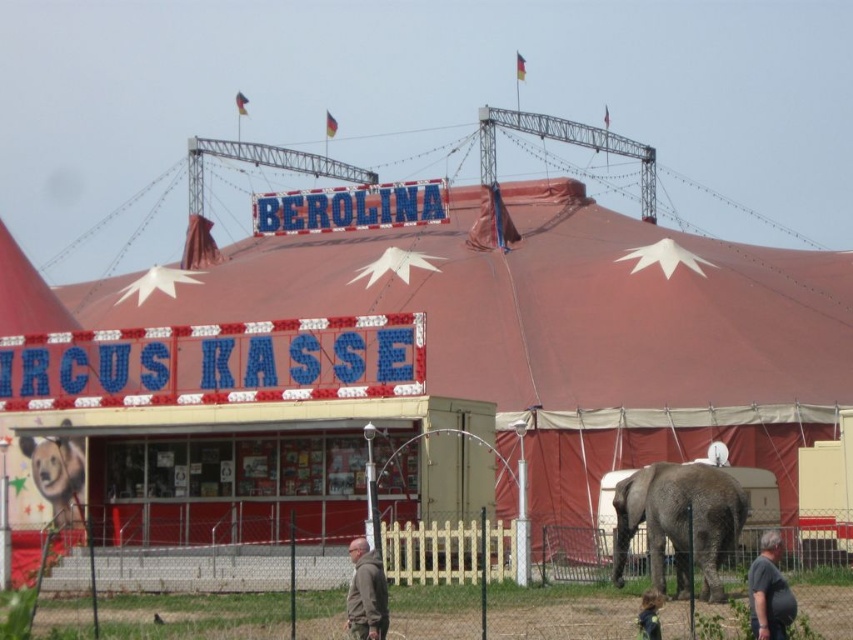
Who is positioned more to the right, fat man at lower right or gray hoodie at center?

Positioned to the right is fat man at lower right.

Which is above, fat man at lower right or gray hoodie at center?

fat man at lower right is above.

Is point (764, 570) closer to viewer compared to point (381, 621)?

That is True.

This screenshot has height=640, width=853. What are the coordinates of `fat man at lower right` in the screenshot? It's located at (769, 592).

Can you confirm if red canvas tent at center is thinner than gray matte elephant at lower right?

No, red canvas tent at center is not thinner than gray matte elephant at lower right.

Based on the photo, can you confirm if red canvas tent at center is bigger than gray matte elephant at lower right?

Indeed, red canvas tent at center has a larger size compared to gray matte elephant at lower right.

Which is behind, point (438, 346) or point (685, 476)?

The point (438, 346) is more distant.

You are a GUI agent. You are given a task and a screenshot of the screen. Output one action in this format:
    pyautogui.click(x=<x>, y=<y>)
    Task: Click on the red canvas tent at center
    This screenshot has width=853, height=640.
    Given the screenshot: What is the action you would take?
    pyautogui.click(x=422, y=362)

This screenshot has height=640, width=853. In order to click on gray matte elephant at lower right in this screenshot , I will do `click(679, 522)`.

Between gray matte elephant at lower right and gray hoodie at center, which one has less height?

gray hoodie at center

Between point (711, 529) and point (363, 556), which one is positioned in front?

Positioned in front is point (363, 556).

Locate an element on the screen. The image size is (853, 640). gray matte elephant at lower right is located at coordinates (679, 522).